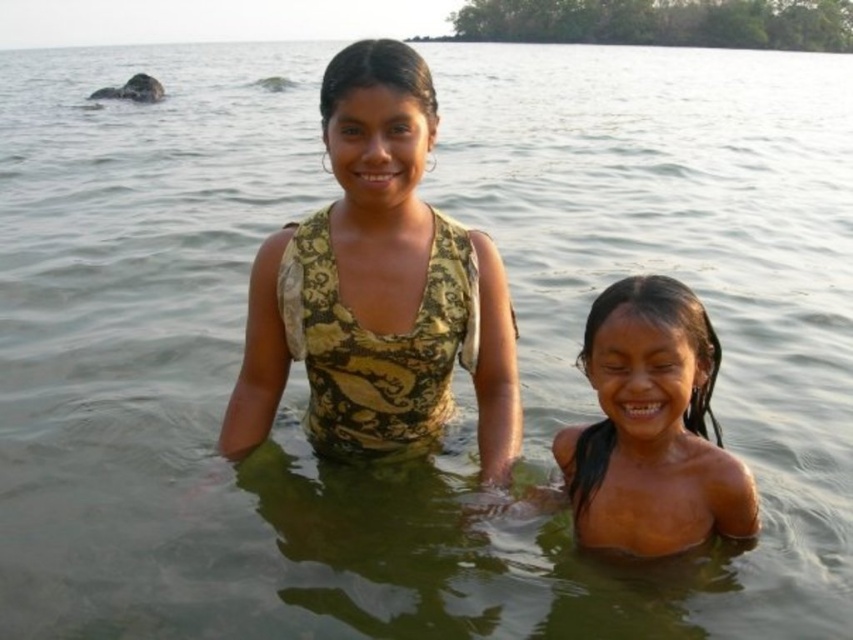
Question: Can you confirm if camouflage fabric top at center is positioned to the right of dry skin at center?

Choices:
 (A) yes
 (B) no

Answer: (B)

Question: Which point appears closest to the camera in this image?

Choices:
 (A) (653, 493)
 (B) (265, 310)

Answer: (A)

Question: Is camouflage fabric top at center behind dry skin at center?

Choices:
 (A) no
 (B) yes

Answer: (B)

Question: Can you confirm if camouflage fabric top at center is thinner than dry skin at center?

Choices:
 (A) yes
 (B) no

Answer: (B)

Question: Which object appears closest to the camera in this image?

Choices:
 (A) dry skin at center
 (B) camouflage fabric top at center

Answer: (A)

Question: Which object appears closest to the camera in this image?

Choices:
 (A) camouflage fabric top at center
 (B) dry skin at center

Answer: (B)